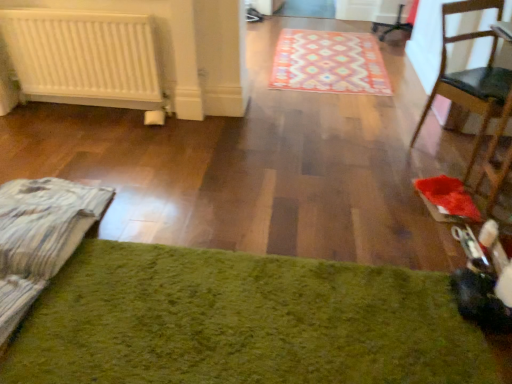
Find the location of a particular element. This screenshot has width=512, height=384. vacant space that's between wooden chair at right and white matte radiator at left is located at coordinates (312, 136).